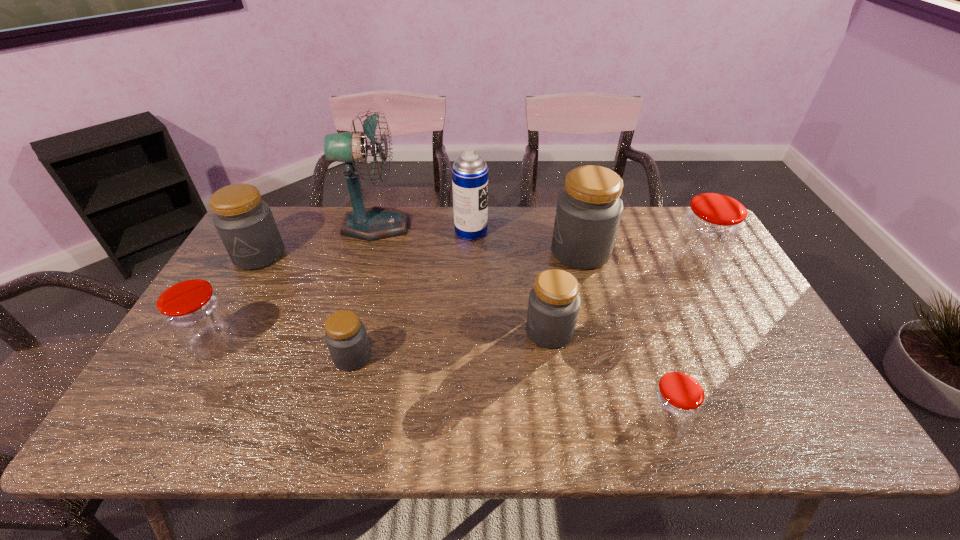
The height and width of the screenshot is (540, 960). What are the coordinates of `vacant point located between the tallest jar and the fifth jar from right to left` in the screenshot? It's located at (467, 305).

Identify the location of unoccupied position between the nearest jar and the leftmost red jar. The width and height of the screenshot is (960, 540). (440, 384).

Where is `empty space that is in between the nearest object and the rightmost red jar`? The height and width of the screenshot is (540, 960). empty space that is in between the nearest object and the rightmost red jar is located at coordinates (679, 345).

Image resolution: width=960 pixels, height=540 pixels. Find the location of `blank region between the fifth jar from right to left and the second biggest gray jar`. blank region between the fifth jar from right to left and the second biggest gray jar is located at coordinates (306, 306).

At what (x,y) coordinates should I click in order to perform the action: click on empty location between the second biggest red jar and the rightmost object. Please return your answer as a coordinate pair (x, y). Image resolution: width=960 pixels, height=540 pixels. Looking at the image, I should click on (454, 306).

Locate an element on the screen. empty location between the third smallest gray jar and the farthest red jar is located at coordinates (476, 261).

Select which object is the sixth closest to the third biggest gray jar. Please provide its 2D coordinates. Your answer should be formatted as a tuple, i.e. [(x, y)], where the tuple contains the x and y coordinates of a point satisfying the conditions above.

[(374, 223)]

Locate an element on the screen. The height and width of the screenshot is (540, 960). object that is the fifth closest to the fifth object from right to left is located at coordinates (245, 223).

Locate an element on the screen. Image resolution: width=960 pixels, height=540 pixels. jar that is the fifth closest to the fan is located at coordinates (589, 209).

You are a GUI agent. You are given a task and a screenshot of the screen. Output one action in this format:
    pyautogui.click(x=<x>, y=<y>)
    Task: Click on the jar that is the third closest to the fan
    
    Given the screenshot: What is the action you would take?
    pyautogui.click(x=346, y=337)